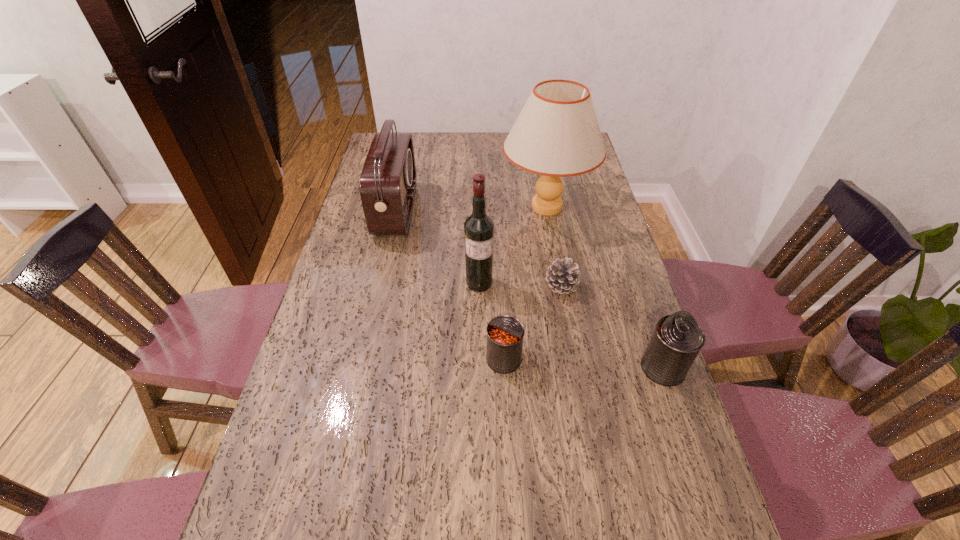
In the image, there is a desktop. Find the location of `free space at the left edge`. free space at the left edge is located at coordinates (325, 307).

The height and width of the screenshot is (540, 960). I want to click on vacant space at the right edge of the desktop, so click(571, 232).

Where is `free location at the near right corner of the desktop`? This screenshot has height=540, width=960. free location at the near right corner of the desktop is located at coordinates [697, 515].

The width and height of the screenshot is (960, 540). Find the location of `free area in between the third tallest object and the wine bottle`. free area in between the third tallest object and the wine bottle is located at coordinates (438, 247).

Locate an element on the screen. The height and width of the screenshot is (540, 960). unoccupied position between the fourth shortest object and the right can is located at coordinates (530, 289).

The height and width of the screenshot is (540, 960). In order to click on empty space between the pinecone and the third shortest object in this screenshot , I will do `click(612, 327)`.

At what (x,y) coordinates should I click in order to perform the action: click on free space between the lampshade and the fourth shortest object. Please return your answer as a coordinate pair (x, y). This screenshot has height=540, width=960. Looking at the image, I should click on (471, 209).

Find the location of a particular element. The image size is (960, 540). empty location between the lampshade and the shortest object is located at coordinates (554, 247).

Locate an element on the screen. The image size is (960, 540). free space between the left can and the pinecone is located at coordinates tap(533, 323).

You are a GUI agent. You are given a task and a screenshot of the screen. Output one action in this format:
    pyautogui.click(x=<x>, y=<y>)
    Task: Click on the third closest object to the wine bottle
    
    Given the screenshot: What is the action you would take?
    pyautogui.click(x=505, y=334)